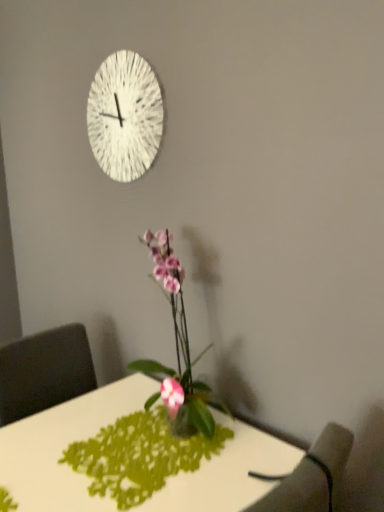
Question: Is white glossy desk at center not close to white textured clock at upper center?

Choices:
 (A) no
 (B) yes

Answer: (A)

Question: Can you confirm if white glossy desk at center is positioned to the left of white textured clock at upper center?

Choices:
 (A) yes
 (B) no

Answer: (B)

Question: From the image's perspective, is white glossy desk at center on white textured clock at upper center?

Choices:
 (A) yes
 (B) no

Answer: (B)

Question: From the image's perspective, is white glossy desk at center under white textured clock at upper center?

Choices:
 (A) yes
 (B) no

Answer: (A)

Question: Is white glossy desk at center placed right next to white textured clock at upper center?

Choices:
 (A) no
 (B) yes

Answer: (A)

Question: Is white textured clock at upper center at the back of white glossy desk at center?

Choices:
 (A) yes
 (B) no

Answer: (B)

Question: Considering the relative positions of pink glossy orchid at center and white textured clock at upper center in the image provided, is pink glossy orchid at center behind white textured clock at upper center?

Choices:
 (A) yes
 (B) no

Answer: (B)

Question: From a real-world perspective, is pink glossy orchid at center physically below white textured clock at upper center?

Choices:
 (A) yes
 (B) no

Answer: (A)

Question: Can you confirm if pink glossy orchid at center is taller than white textured clock at upper center?

Choices:
 (A) no
 (B) yes

Answer: (B)

Question: Considering the relative sizes of pink glossy orchid at center and white textured clock at upper center in the image provided, is pink glossy orchid at center bigger than white textured clock at upper center?

Choices:
 (A) yes
 (B) no

Answer: (A)

Question: Is pink glossy orchid at center wider than white textured clock at upper center?

Choices:
 (A) no
 (B) yes

Answer: (B)

Question: Can you confirm if pink glossy orchid at center is positioned to the left of white textured clock at upper center?

Choices:
 (A) no
 (B) yes

Answer: (A)

Question: Does dark gray fabric armchair at lower right touch pink glossy orchid at center?

Choices:
 (A) no
 (B) yes

Answer: (A)